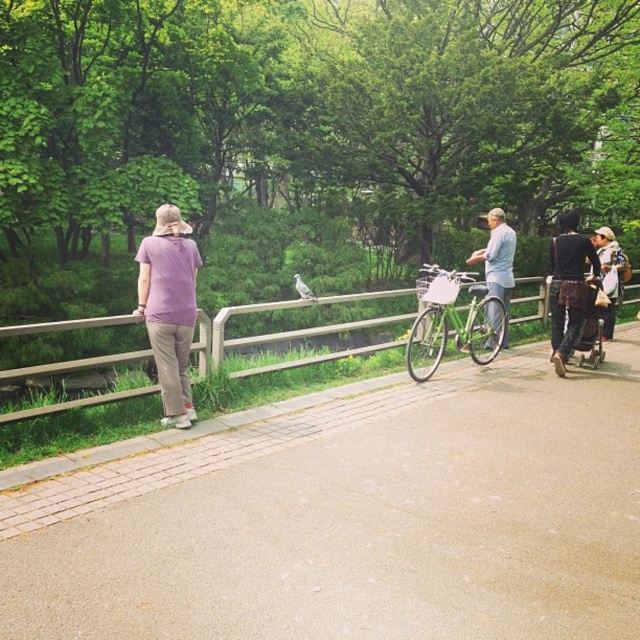
Can you confirm if concrete pavement at center is smaller than wooden fence at left?

Yes.

Looking at this image, between concrete pavement at center and wooden fence at left, which one is positioned lower?

concrete pavement at center is below.

The width and height of the screenshot is (640, 640). Find the location of `concrete pavement at center`. concrete pavement at center is located at coordinates (355, 520).

Is green matte bicycle at center positioned behind light blue fabric shirt at center?

That is False.

Who is positioned more to the right, green matte bicycle at center or light blue fabric shirt at center?

Positioned to the right is light blue fabric shirt at center.

Consider the image. Measure the distance between green matte bicycle at center and camera.

A distance of 7.46 meters exists between green matte bicycle at center and camera.

Identify the location of green matte bicycle at center. (451, 321).

How far apart are purple cotton shirt at left and green matte bicycle at center?

They are 11.28 feet apart.

Does purple cotton shirt at left appear under green matte bicycle at center?

No.

This screenshot has width=640, height=640. Identify the location of purple cotton shirt at left. (170, 307).

I want to click on purple cotton shirt at left, so click(x=170, y=307).